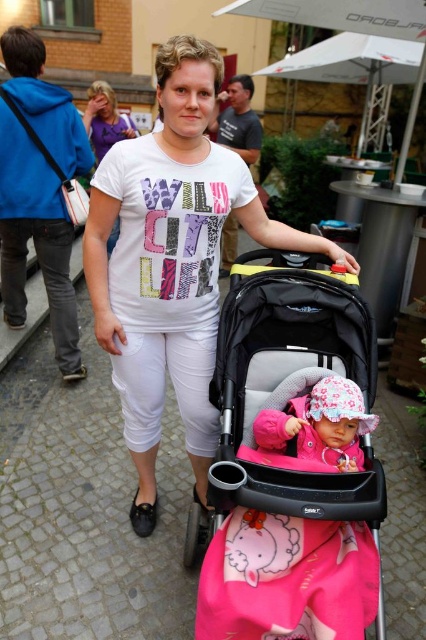
You are standing 5 feet away from the cobblestone pavement at center. Can you step onto it without moving forward?

The cobblestone pavement at center is 6.06 feet away from you. Since you are only 5 feet away from it, you can step onto it without moving forward.

You are a delivery person holding a package that needs to be placed 3 meters away from the camera. You see the brushed metal bag at left in the scene. Can you use it as a reference point to determine where to place the package?

The distance between the brushed metal bag at left and the camera is 2.82 meters. Since the required placement is 3 meters away, the package should be placed slightly further beyond the brushed metal bag at left to meet the 3 meter requirement.